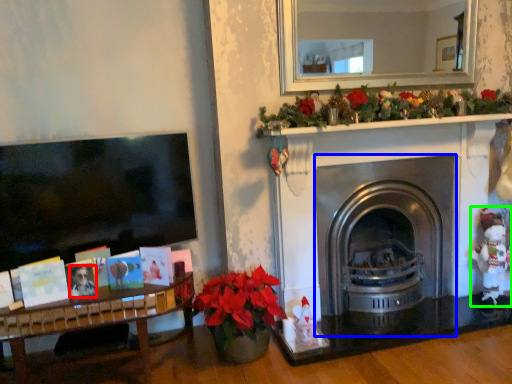
Question: Considering the real-world distances, which object is farthest from person (highlighted by a red box)? fireplace (highlighted by a blue box) or toy (highlighted by a green box)?

Choices:
 (A) fireplace
 (B) toy

Answer: (B)